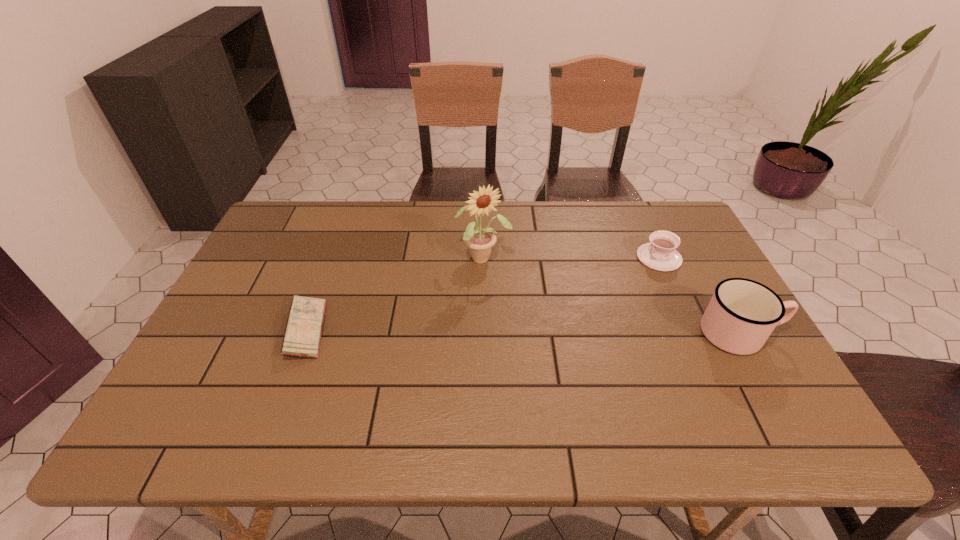
Locate an element on the screen. This screenshot has height=540, width=960. vacant position located on the handle side of the teacup is located at coordinates (611, 284).

Where is `free spot located on the handle side of the teacup`? Image resolution: width=960 pixels, height=540 pixels. free spot located on the handle side of the teacup is located at coordinates (603, 288).

You are a GUI agent. You are given a task and a screenshot of the screen. Output one action in this format:
    pyautogui.click(x=<x>, y=<y>)
    Task: Click on the object present at the far edge
    The image size is (960, 540).
    Given the screenshot: What is the action you would take?
    pyautogui.click(x=660, y=254)

At what (x,y) coordinates should I click in order to perform the action: click on mug at the right edge. Please return your answer as a coordinate pair (x, y). This screenshot has height=540, width=960. Looking at the image, I should click on (741, 315).

This screenshot has width=960, height=540. I want to click on teacup present at the right edge, so click(660, 254).

Where is `object that is positioned at the far right corner`? object that is positioned at the far right corner is located at coordinates (660, 254).

At what (x,y) coordinates should I click in order to perform the action: click on vacant space at the far edge of the desktop. Please return your answer as a coordinate pair (x, y). The height and width of the screenshot is (540, 960). Looking at the image, I should click on (620, 226).

Image resolution: width=960 pixels, height=540 pixels. In the image, there is a desktop. What are the coordinates of `free space at the near edge` in the screenshot? It's located at (666, 387).

The image size is (960, 540). In order to click on vacant space at the left edge of the desktop in this screenshot , I will do `click(221, 308)`.

In the image, there is a desktop. Identify the location of vacant region at the right edge. The width and height of the screenshot is (960, 540). (700, 268).